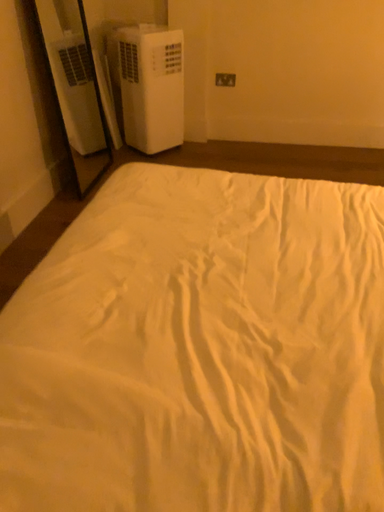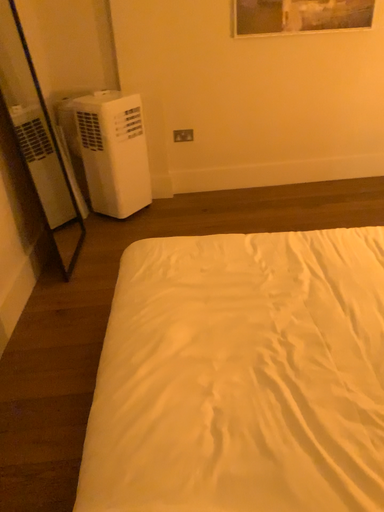
Question: Which way did the camera rotate in the video?

Choices:
 (A) rotated right
 (B) rotated left

Answer: (A)